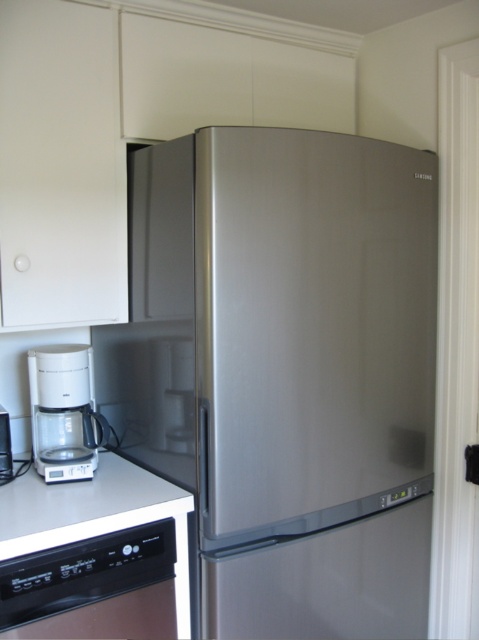
You are standing in the kitchen and want to grab a glass from the upper cabinet. The glass is located on the shelf above the stainless steel refrigerator at center. If you can reach up to 1.8 meters, will you be able to reach it?

The stainless steel refrigerator at center is 1.45 meters away from the viewer. Since the glass is on the shelf above it, you would need to reach approximately 1.45 meters plus the height of the fridge to the shelf. However, without knowing the exact height of the fridge itself, it is impossible to determine if your reach of 1.8 meters is sufficient. Therefore, the answer cannot be confirmed with the given information.

You are organizing the kitchen and need to move the white plastic coffee maker at lower left closer to the sink, which is to the left of the black glossy oven at lower left. Can you move the coffee maker without moving the oven first?

The black glossy oven at lower left is positioned on the right side of white plastic coffee maker at lower left, so the coffee maker is already to the left of the oven. Since the sink is also to the left of the oven, you can move the white plastic coffee maker at lower left towards the sink without needing to move the oven first.

You are organizing the kitchen and need to place a new appliance that is 1.2 meters wide. The stainless steel refrigerator at center and the white plastic coffee maker at lower left are already there. Which appliance can you place next to the narrower one without exceeding the 1.2 meter width limit?

The white plastic coffee maker at lower left is narrower than the stainless steel refrigerator at center. Since the coffee maker is narrower, you can place the new appliance next to it without exceeding the 1.2 meter width limit.